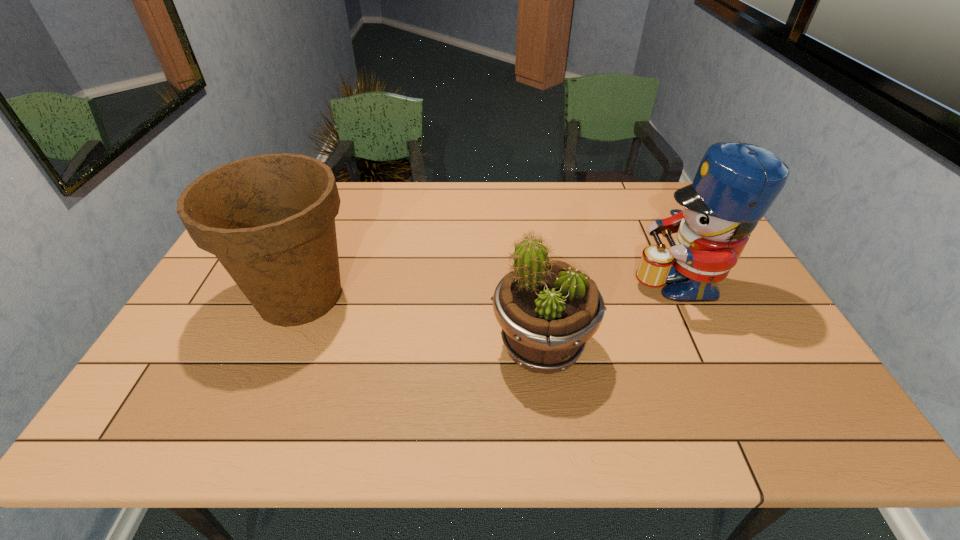
This screenshot has height=540, width=960. Find the location of `free region that satisfies the following two spatial constraints: 1. on the front-facing side of the tallest object; 2. on the front side of the leftmost object`. free region that satisfies the following two spatial constraints: 1. on the front-facing side of the tallest object; 2. on the front side of the leftmost object is located at coordinates (683, 296).

Identify the location of free space that satisfies the following two spatial constraints: 1. on the front-facing side of the tallest object; 2. on the front side of the second object from left to right. The image size is (960, 540). (707, 347).